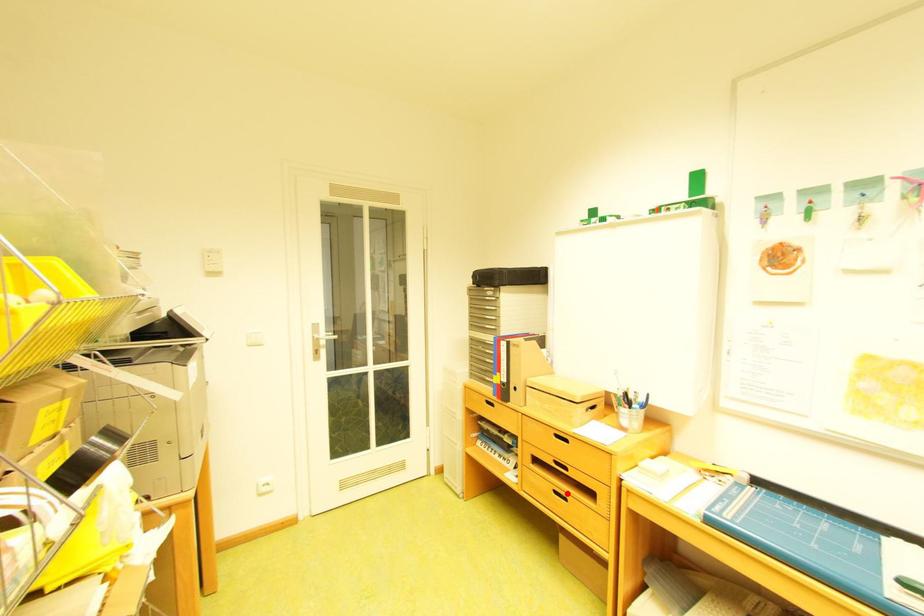
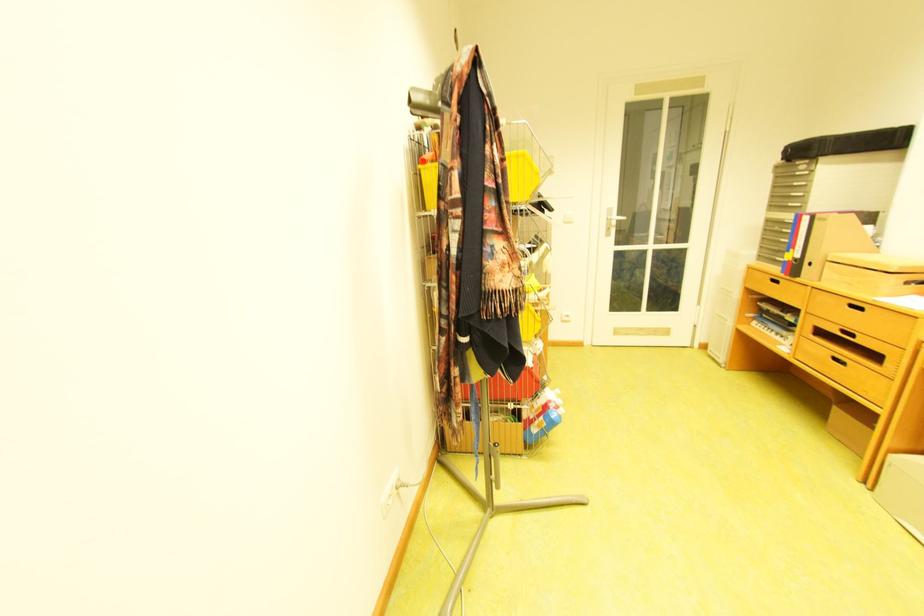
In the second image, find the point that corresponds to the highlighted location in the first image.

(845, 360)